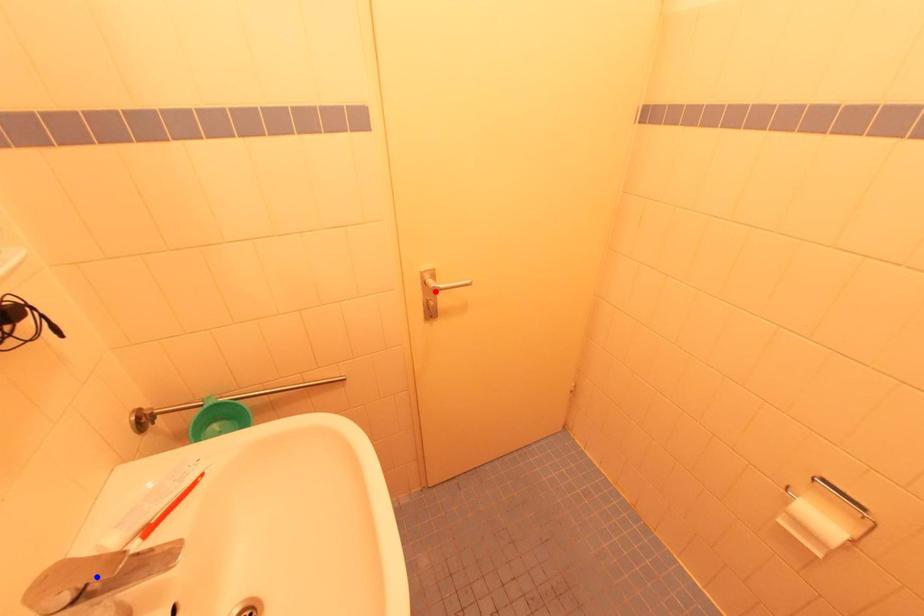
Question: Two points are marked on the image. Which point is closer to the camera?

Choices:
 (A) Blue point is closer.
 (B) Red point is closer.

Answer: (A)